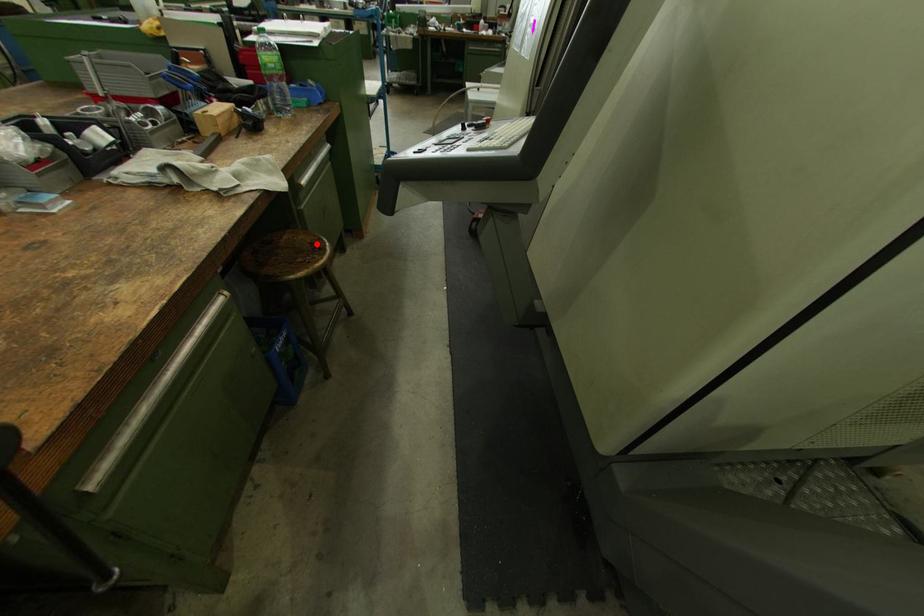
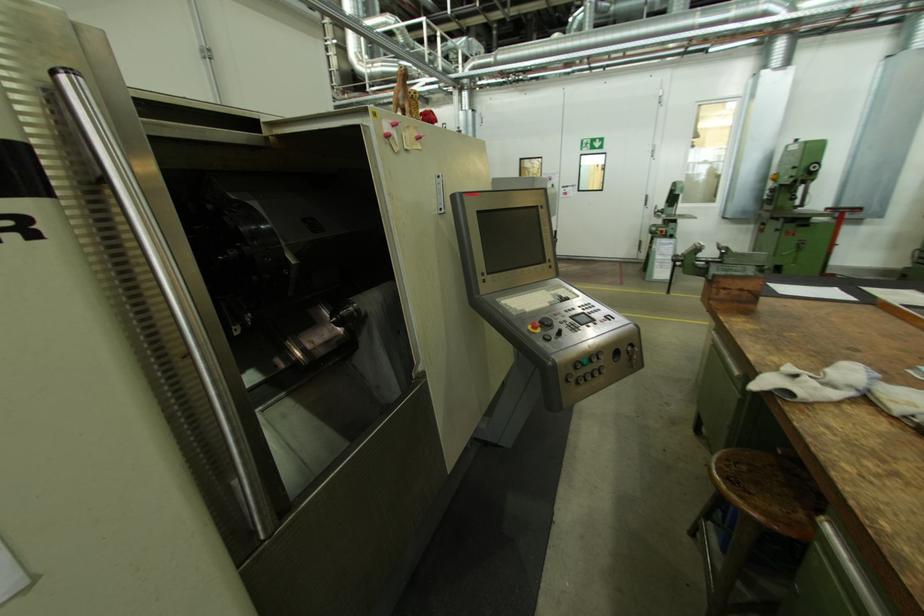
Question: I am providing you with two images of the same scene from different viewpoints. A red point is shown in image1. For the corresponding object point in image2, is it positioned nearer or farther from the camera?

Choices:
 (A) Nearer
 (B) Farther

Answer: (B)